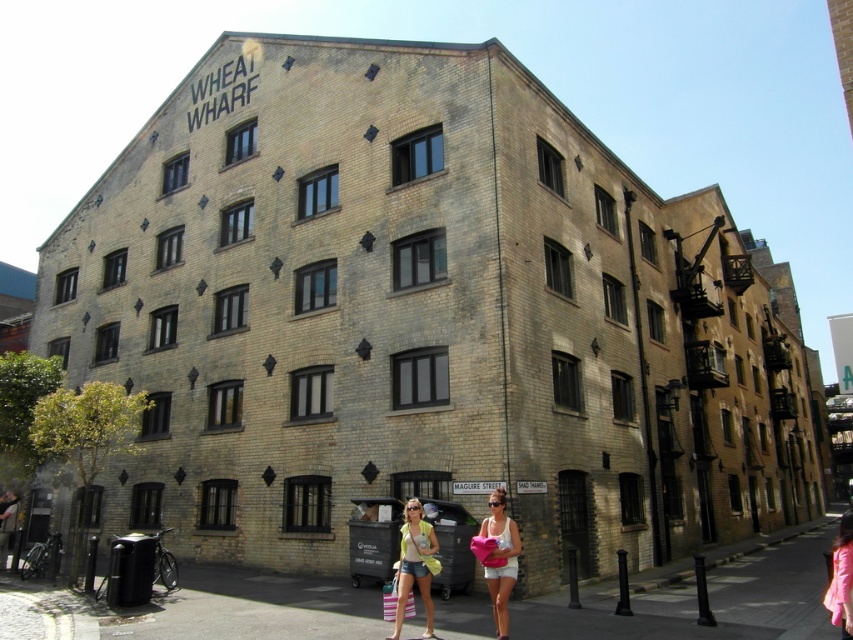
You are standing on the street in front of the building and see the yellow cotton tank top at lower center and the pink fabric at lower right. Which one is positioned more to the left side?

The yellow cotton tank top at lower center is positioned more to the left side than the pink fabric at lower right.

You are a fashion designer observing the scene. You notice the yellow cotton tank top at lower center and the pink fabric at lower right. Which clothing item appears narrower?

The yellow cotton tank top at lower center is narrower than the pink fabric at lower right.